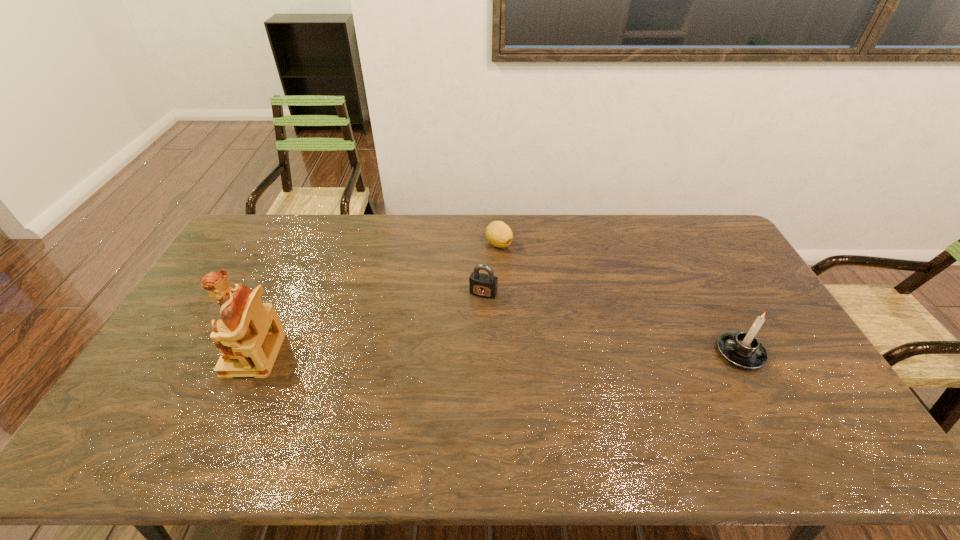
I want to click on object that is at the right edge, so click(x=742, y=349).

In the image, there is a desktop. At what (x,y) coordinates should I click in order to perform the action: click on free space at the far edge. Please return your answer as a coordinate pair (x, y). The image size is (960, 540). Looking at the image, I should click on click(x=283, y=252).

In the image, there is a desktop. Where is `vacant space at the near edge`? The height and width of the screenshot is (540, 960). vacant space at the near edge is located at coordinates (767, 420).

This screenshot has width=960, height=540. In the image, there is a desktop. In order to click on vacant space at the left edge in this screenshot , I will do `click(187, 387)`.

Find the location of a particular element. The width and height of the screenshot is (960, 540). vacant space at the right edge of the desktop is located at coordinates (793, 358).

The image size is (960, 540). I want to click on vacant space that is in between the second shortest object and the leftmost object, so click(369, 323).

Where is `vacant point located between the candle holder and the farthest object`? The height and width of the screenshot is (540, 960). vacant point located between the candle holder and the farthest object is located at coordinates (619, 298).

I want to click on vacant space that is in between the farthest object and the figurine, so click(x=376, y=299).

Where is `free space between the leftmost object and the rightmost object`? The width and height of the screenshot is (960, 540). free space between the leftmost object and the rightmost object is located at coordinates coord(497,354).

The width and height of the screenshot is (960, 540). What are the coordinates of `vacant point located between the leftmost object and the rightmost object` in the screenshot? It's located at (497, 354).